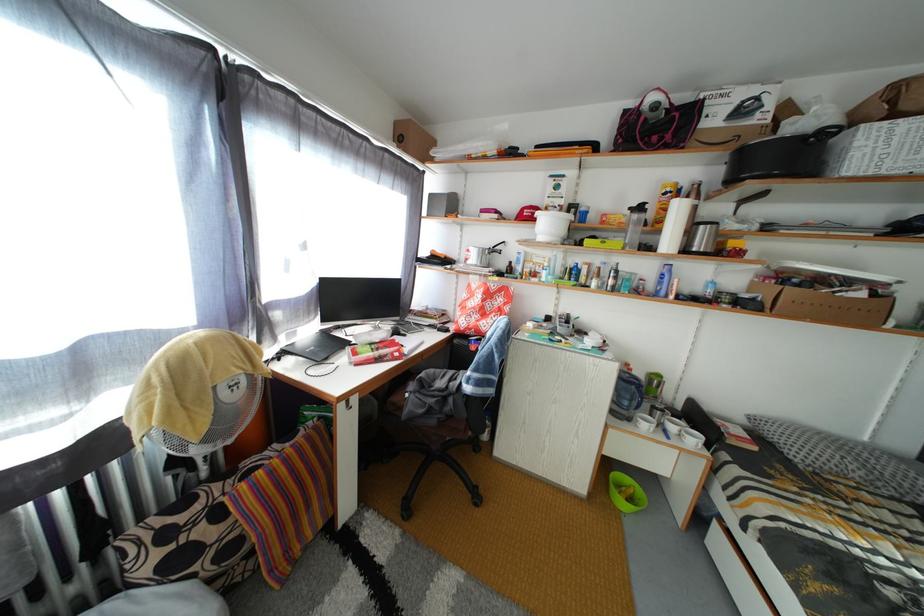
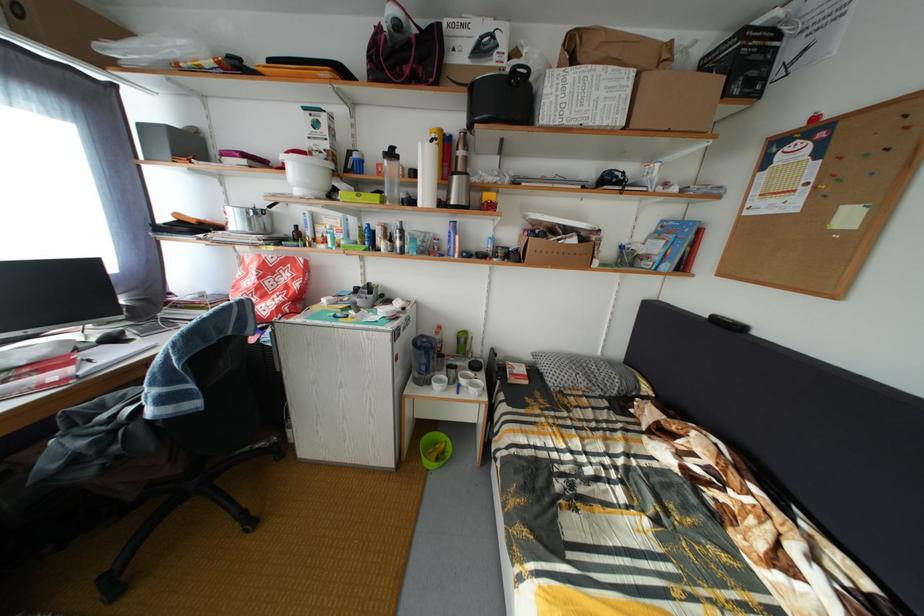
Where in the second image is the point corresponding to pixel 711 233 from the first image?

(464, 184)